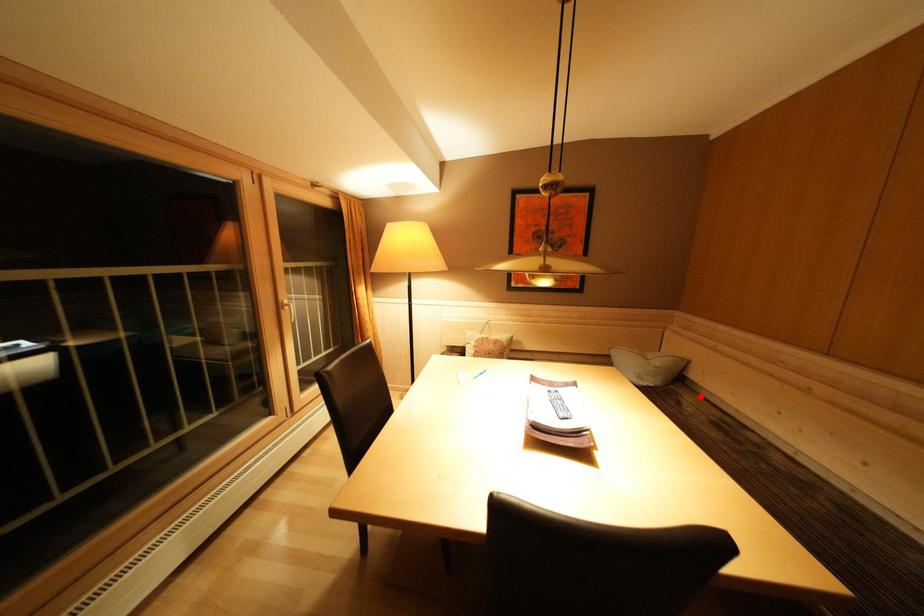
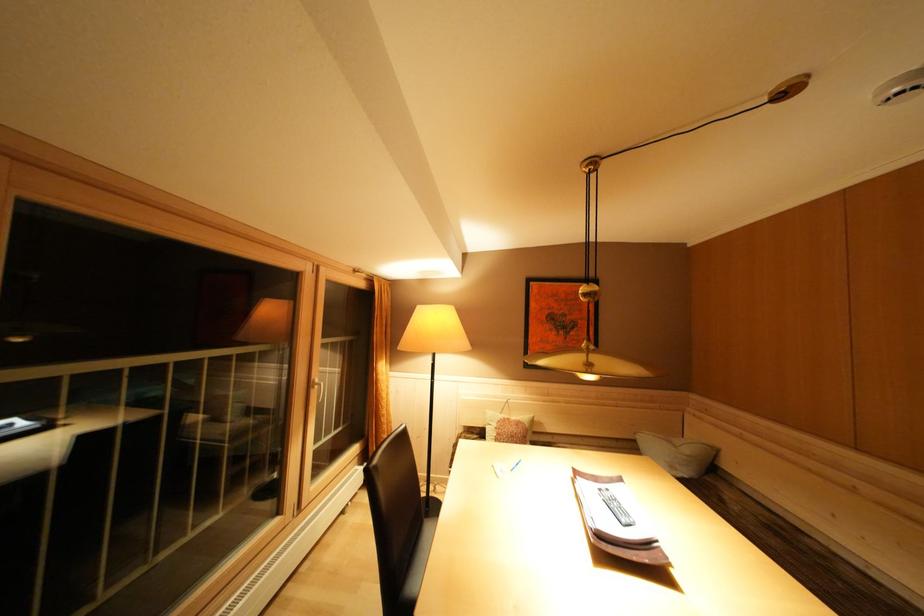
Find the pixel in the second image that matches the highlighted location in the first image.

(737, 490)